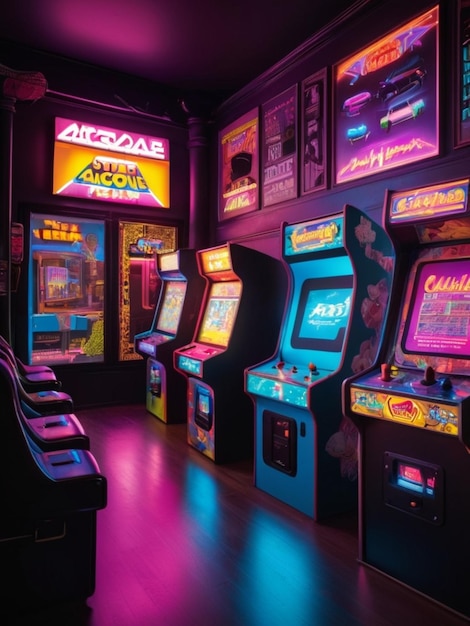
Where is `blue arcade machine`? This screenshot has width=470, height=626. blue arcade machine is located at coordinates (298, 270).